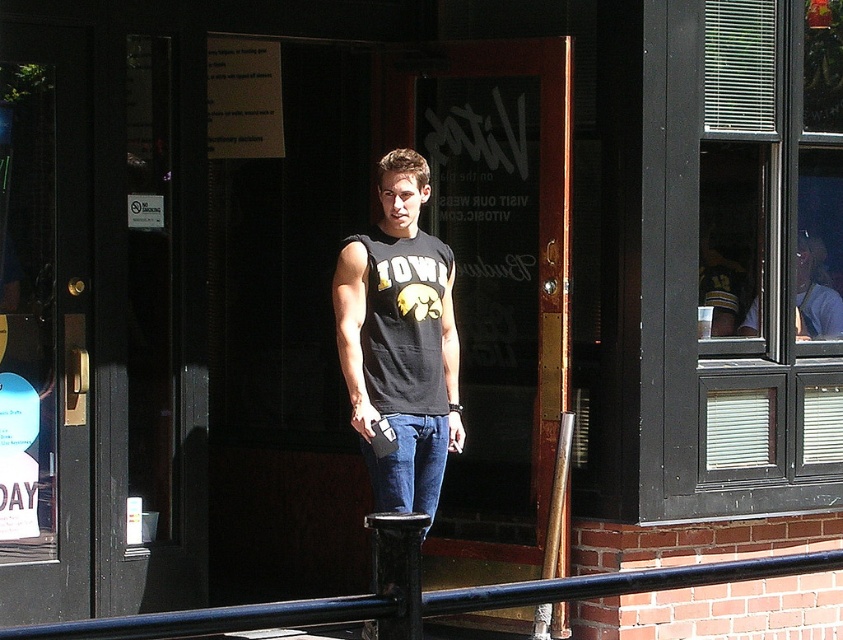
Which is more to the right, black metal rail at center or jeans at center?

black metal rail at center is more to the right.

Does black metal rail at center have a lesser height compared to jeans at center?

Correct, black metal rail at center is not as tall as jeans at center.

Who is more forward, (492, 589) or (433, 422)?

Point (492, 589) is in front.

Find the location of `black metal rail at center`. black metal rail at center is located at coordinates (419, 593).

You are a GUI agent. You are given a task and a screenshot of the screen. Output one action in this format:
    pyautogui.click(x=<x>, y=<y>)
    Task: Click on the black matte tank top at center
    This screenshot has height=640, width=843.
    Given the screenshot: What is the action you would take?
    pyautogui.click(x=400, y=339)

Does black matte tank top at center have a lesser width compared to jeans at center?

In fact, black matte tank top at center might be wider than jeans at center.

Who is more forward, (390, 388) or (369, 458)?

Point (390, 388) is more forward.

The image size is (843, 640). Find the location of `black matte tank top at center`. black matte tank top at center is located at coordinates (400, 339).

The width and height of the screenshot is (843, 640). Describe the element at coordinates (400, 339) in the screenshot. I see `black matte tank top at center` at that location.

Is black matte tank top at center to the right of black metal rail at center from the viewer's perspective?

Incorrect, black matte tank top at center is not on the right side of black metal rail at center.

Locate an element on the screen. This screenshot has width=843, height=640. black matte tank top at center is located at coordinates (400, 339).